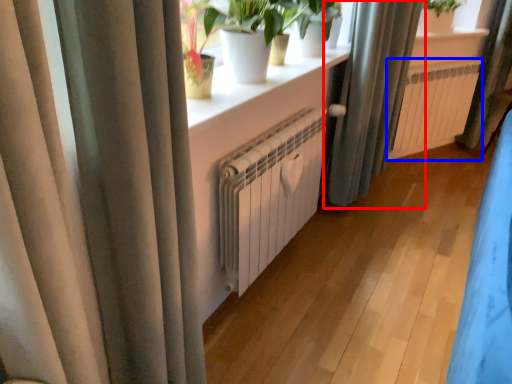
Question: Which object appears closest to the camera in this image, curtain (highlighted by a red box) or radiator (highlighted by a blue box)?

Choices:
 (A) curtain
 (B) radiator

Answer: (A)